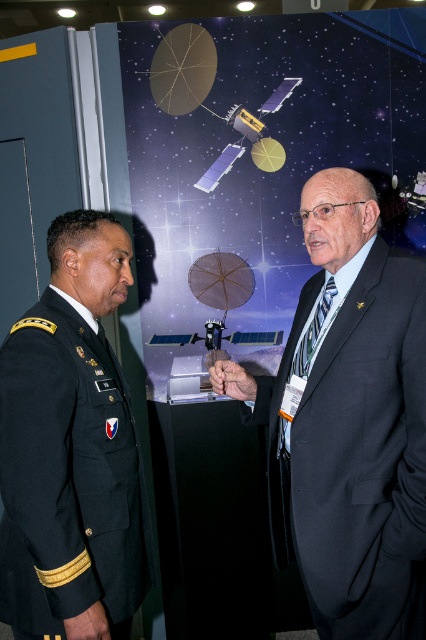
What is the 2D coordinate of the dark blue suit at center?

The dark blue suit at center is located at point (353, 419).